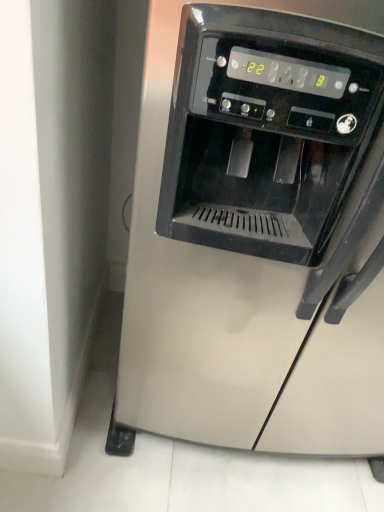
Image resolution: width=384 pixels, height=512 pixels. What do you see at coordinates (259, 230) in the screenshot? I see `satin silver refrigerator at center` at bounding box center [259, 230].

In order to click on satin silver refrigerator at center in this screenshot , I will do `click(259, 230)`.

What is the approximate width of satin silver refrigerator at center?

satin silver refrigerator at center is 79.97 centimeters wide.

This screenshot has height=512, width=384. Find the location of `satin silver refrigerator at center`. satin silver refrigerator at center is located at coordinates (259, 230).